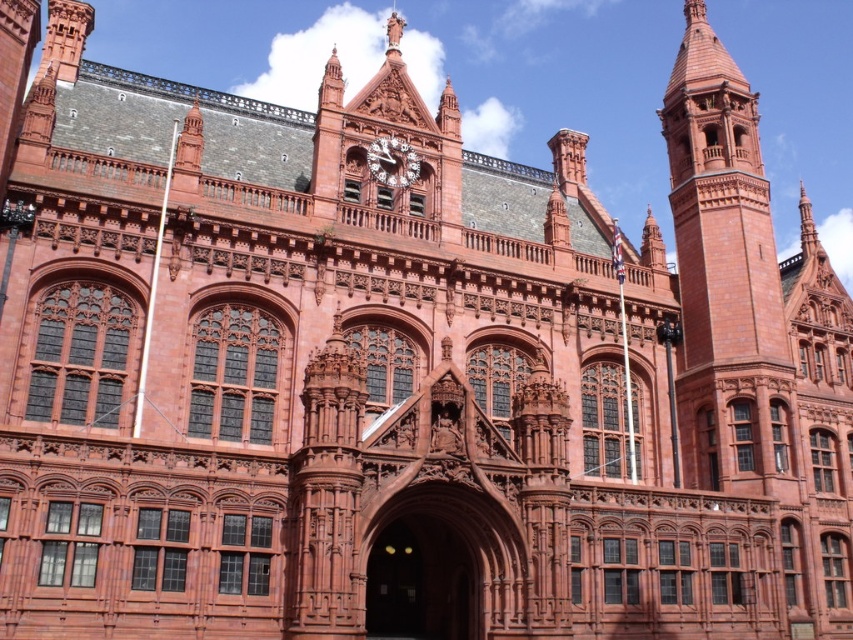
Question: Considering the relative positions of smooth stone archway at center and polished brass clock at center in the image provided, where is smooth stone archway at center located with respect to polished brass clock at center?

Choices:
 (A) above
 (B) below

Answer: (B)

Question: Which object appears closest to the camera in this image?

Choices:
 (A) smooth stone archway at center
 (B) polished brass clock at center

Answer: (A)

Question: Which point is closer to the camera?

Choices:
 (A) (389, 184)
 (B) (421, 556)

Answer: (B)

Question: Among these objects, which one is farthest from the camera?

Choices:
 (A) polished brass clock at center
 (B) smooth stone archway at center

Answer: (A)

Question: Can you confirm if smooth stone archway at center is bigger than polished brass clock at center?

Choices:
 (A) yes
 (B) no

Answer: (A)

Question: Does smooth stone archway at center have a larger size compared to polished brass clock at center?

Choices:
 (A) no
 (B) yes

Answer: (B)